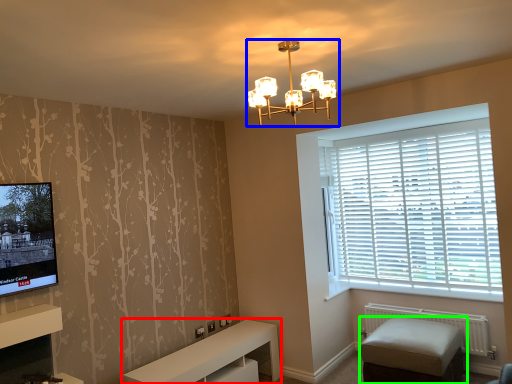
Question: Based on their relative distances, which object is nearer to furniture (highlighted by a red box)? Choose from lamp (highlighted by a blue box) and studio couch (highlighted by a green box).

Choices:
 (A) lamp
 (B) studio couch

Answer: (B)